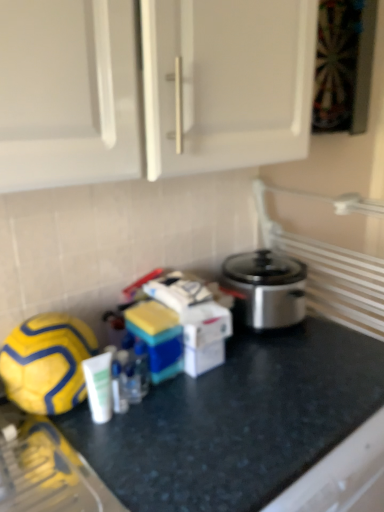
Where is `free space above yellow matte football at lower left (from a real-world perspective)`? free space above yellow matte football at lower left (from a real-world perspective) is located at coordinates (43, 328).